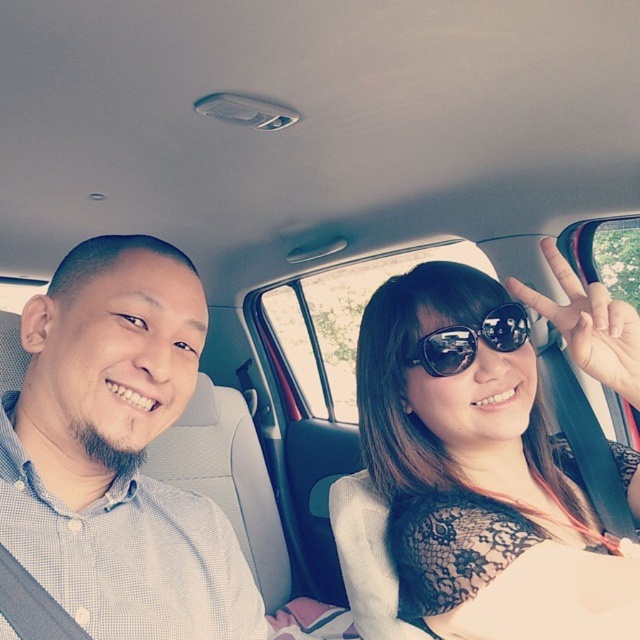
Based on the scene description, can you determine the spatial relationship between the white checkered shirt at left and the black lace top with white cardigan in the car?

The white checkered shirt at left is located at point (116,452), while the black lace top with white cardigan is positioned further to the right and slightly higher in the car interior.

You are a photographer taking a picture of the two people in the car. You notice the sunglasseslace fabric at center and the sunglasses at center. Which object is taller in the photo?

The sunglasseslace fabric at center is taller than the sunglasses at center.